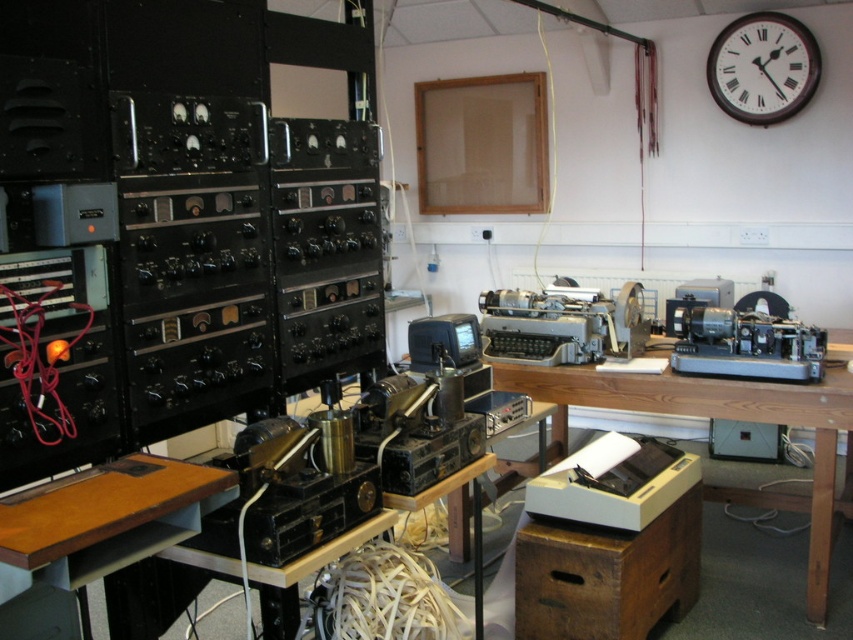
You are organizing a workshop and need to place a decorative plant between the wooden table at center and the metallic gray typewriter at center. According to the layout, where should you place the plant?

The wooden table at center is to the right of the metallic gray typewriter at center, so you should place the plant between them, positioning it to the right of the metallic gray typewriter at center and to the left of the wooden table at center.

You are standing in the workshop and need to locate two specific points marked on the wall. The first point is at coordinates point (500, 467) and the second is at point (782, 72). Based on their positions, which point is closer to you?

Point (500, 467) is in front of point (782, 72), so it is closer to you.

You are organizing a small electronics fair and need to place a decorative item on the wooden table at center. The brown wooden clock at upper right is available. Will the clock fit on the table?

The wooden table at center is bigger than the brown wooden clock at upper right, so the clock will fit on the table.